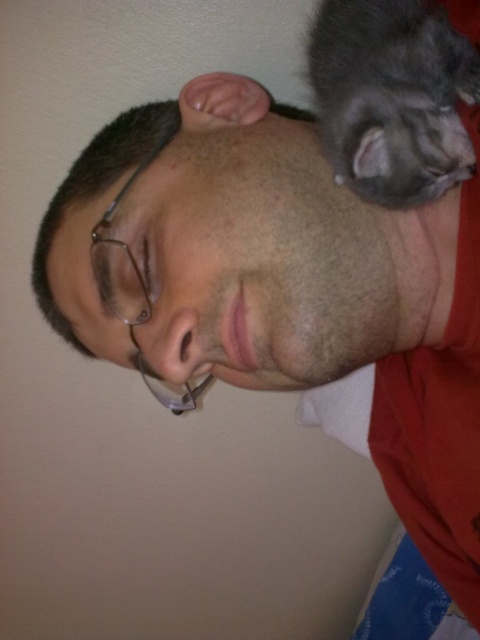
You are taking a photo of the scene and want to focus on the point closer to the camera. Which point should you choose between point (190,285) and point (463,140)?

Point (190,285) is further to the camera than point (463,140), so you should choose point (190,285) to focus on the closer point.

You are a photographer trying to capture a close shot of the matte black hair at upper center and the gray fluffy cat at upper right. Which object is located to the left of the other?

The matte black hair at upper center is positioned on the left side of gray fluffy cat at upper right.